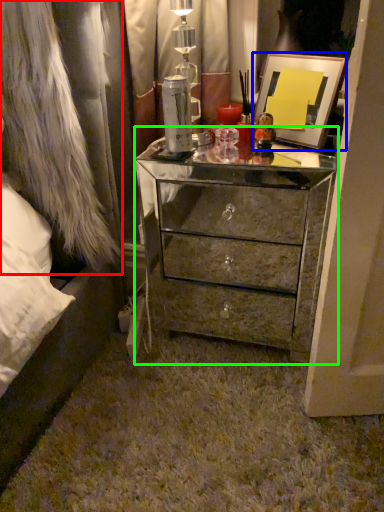
Question: Which is farther away from fur coat (highlighted by a red box)? picture frame (highlighted by a blue box) or chest of drawers (highlighted by a green box)?

Choices:
 (A) picture frame
 (B) chest of drawers

Answer: (A)